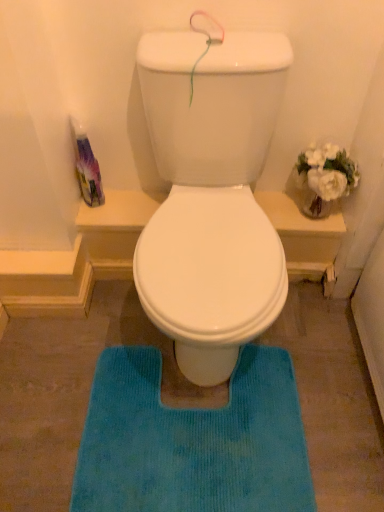
This screenshot has width=384, height=512. In order to click on free location to the left of blue textured bath mat at center in this screenshot , I will do `click(43, 396)`.